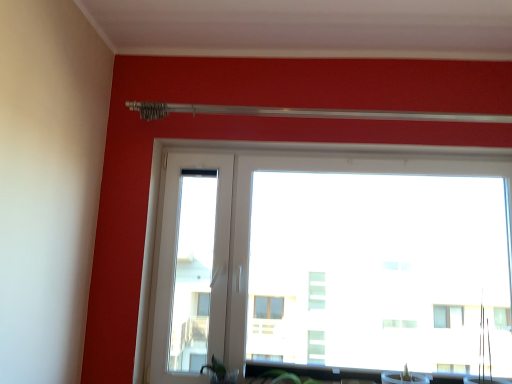
Find the location of `green matte plant at lower center`. green matte plant at lower center is located at coordinates (220, 372).

The width and height of the screenshot is (512, 384). Describe the element at coordinates (220, 372) in the screenshot. I see `green matte plant at lower center` at that location.

Identify the location of transparent glass window at center. This screenshot has height=384, width=512. (330, 263).

What do you see at coordinates (330, 263) in the screenshot? I see `transparent glass window at center` at bounding box center [330, 263].

Where is `green matte plant at lower center`? The image size is (512, 384). green matte plant at lower center is located at coordinates (220, 372).

Which is more to the right, transparent glass window at center or green matte plant at lower center?

transparent glass window at center is more to the right.

In the scene shown: Is transparent glass window at center closer to camera compared to green matte plant at lower center?

No, it is behind green matte plant at lower center.

Does point (302, 174) appear closer or farther from the camera than point (223, 368)?

Point (302, 174).

From the image's perspective, which one is positioned higher, transparent glass window at center or green matte plant at lower center?

From the image's view, transparent glass window at center is above.

From a real-world perspective, between transparent glass window at center and green matte plant at lower center, who is vertically lower?

In real-world perspective, green matte plant at lower center is lower.

Looking at their sizes, would you say transparent glass window at center is wider or thinner than green matte plant at lower center?

Considering their sizes, transparent glass window at center looks broader than green matte plant at lower center.

Who is shorter, transparent glass window at center or green matte plant at lower center?

With less height is green matte plant at lower center.

Based on their sizes in the image, would you say transparent glass window at center is bigger or smaller than green matte plant at lower center?

Clearly, transparent glass window at center is larger in size than green matte plant at lower center.

Is green matte plant at lower center completely or partially inside transparent glass window at center?

No, green matte plant at lower center is not surrounded by transparent glass window at center.

In the scene shown: Is transparent glass window at center far away from green matte plant at lower center?

Yes, transparent glass window at center and green matte plant at lower center are located far from each other.

Is green matte plant at lower center at the back of transparent glass window at center?

Yes.

Identify the location of plant on the left of transparent glass window at center. The width and height of the screenshot is (512, 384). (220, 372).

Between green matte plant at lower center and transparent glass window at center, which one appears on the right side from the viewer's perspective?

Positioned to the right is transparent glass window at center.

Considering the positions of objects green matte plant at lower center and transparent glass window at center in the image provided, who is in front, green matte plant at lower center or transparent glass window at center?

Positioned in front is green matte plant at lower center.

Does point (221, 372) come behind point (362, 218)?

No.

From the image's perspective, would you say green matte plant at lower center is shown under transparent glass window at center?

Yes, from the image's perspective, green matte plant at lower center is beneath transparent glass window at center.

From a real-world perspective, is green matte plant at lower center physically located above or below transparent glass window at center?

green matte plant at lower center is below transparent glass window at center.

Can you confirm if green matte plant at lower center is wider than transparent glass window at center?

In fact, green matte plant at lower center might be narrower than transparent glass window at center.

Considering the relative sizes of green matte plant at lower center and transparent glass window at center in the image provided, is green matte plant at lower center taller than transparent glass window at center?

In fact, green matte plant at lower center may be shorter than transparent glass window at center.

Can you confirm if green matte plant at lower center is bigger than transparent glass window at center?

Incorrect, green matte plant at lower center is not larger than transparent glass window at center.

Is green matte plant at lower center situated inside transparent glass window at center or outside?

green matte plant at lower center is not enclosed by transparent glass window at center.

Is green matte plant at lower center in contact with transparent glass window at center?

green matte plant at lower center and transparent glass window at center are clearly separated.

Could you tell me if green matte plant at lower center is turned towards transparent glass window at center?

No, green matte plant at lower center is not oriented towards transparent glass window at center.

How distant is green matte plant at lower center from transparent glass window at center?

green matte plant at lower center and transparent glass window at center are 4.20 feet apart from each other.

At what (x,y) coordinates should I click in order to perform the action: click on plant that is below the transparent glass window at center (from the image's perspective). Please return your answer as a coordinate pair (x, y). Looking at the image, I should click on (220, 372).

Find the location of a particular element. The image size is (512, 384). window that appears on the right of green matte plant at lower center is located at coordinates (330, 263).

Image resolution: width=512 pixels, height=384 pixels. What are the coordinates of `plant that is under the transparent glass window at center (from a real-world perspective)` in the screenshot? It's located at (220, 372).